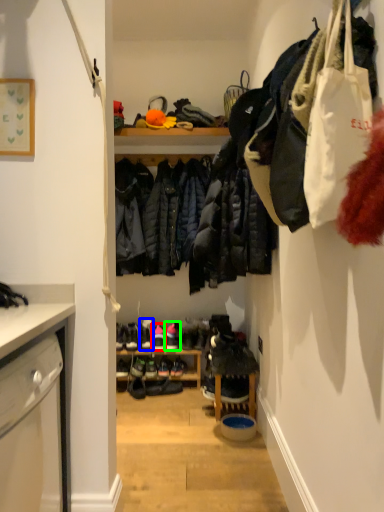
Question: Which is nearer to the footwear (highlighted by a red box)? footwear (highlighted by a blue box) or footwear (highlighted by a green box).

Choices:
 (A) footwear
 (B) footwear

Answer: (B)